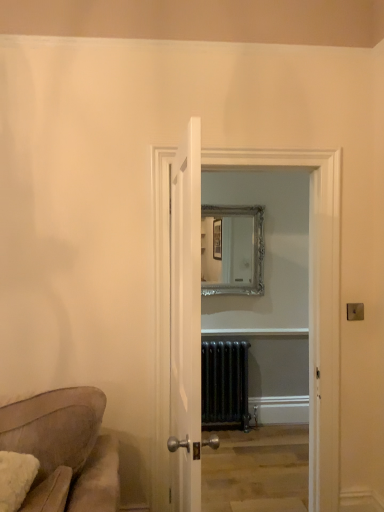
Find the location of a particular element. The width and height of the screenshot is (384, 512). free location above silver/gilded mirror at center (from a real-world perspective) is located at coordinates (226, 204).